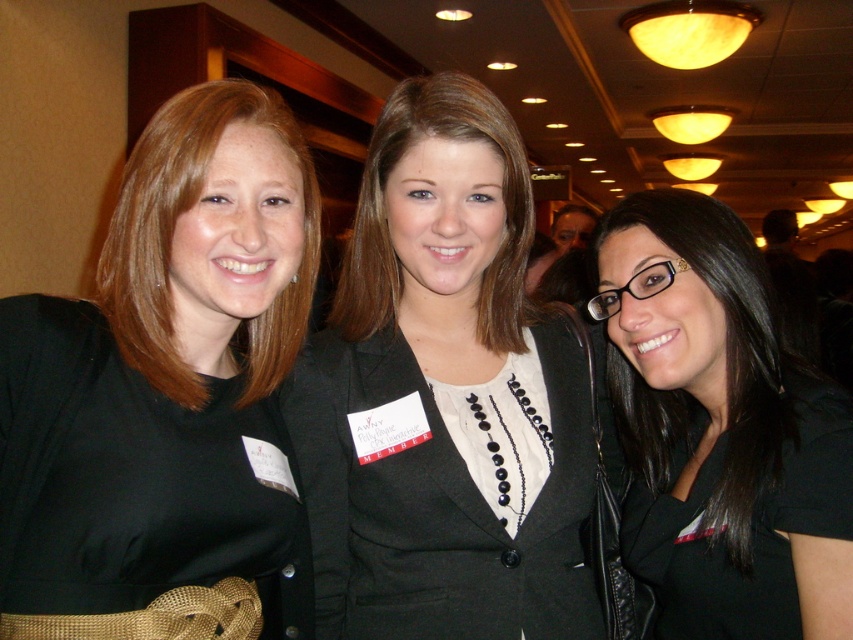
Is matte black dress at center taller than black matte blazer at center?

Incorrect, matte black dress at center's height is not larger of black matte blazer at center's.

Which is behind, point (222, 444) or point (368, 212)?

The point (368, 212) is more distant.

Where is `matte black dress at center`? matte black dress at center is located at coordinates (167, 394).

Which is below, black matte blazer at center or black matte/black textured hair at center?

black matte/black textured hair at center

Measure the distance between point [341,624] and camera.

1.12 meters

Identify the location of black matte blazer at center. (444, 396).

Between matte black dress at center and black matte/black textured hair at center, which one has less height?

Standing shorter between the two is black matte/black textured hair at center.

Can you confirm if matte black dress at center is wider than black matte/black textured hair at center?

Correct, the width of matte black dress at center exceeds that of black matte/black textured hair at center.

Is point (61, 301) farther from camera compared to point (639, 538)?

No.

The image size is (853, 640). I want to click on matte black dress at center, so [x=167, y=394].